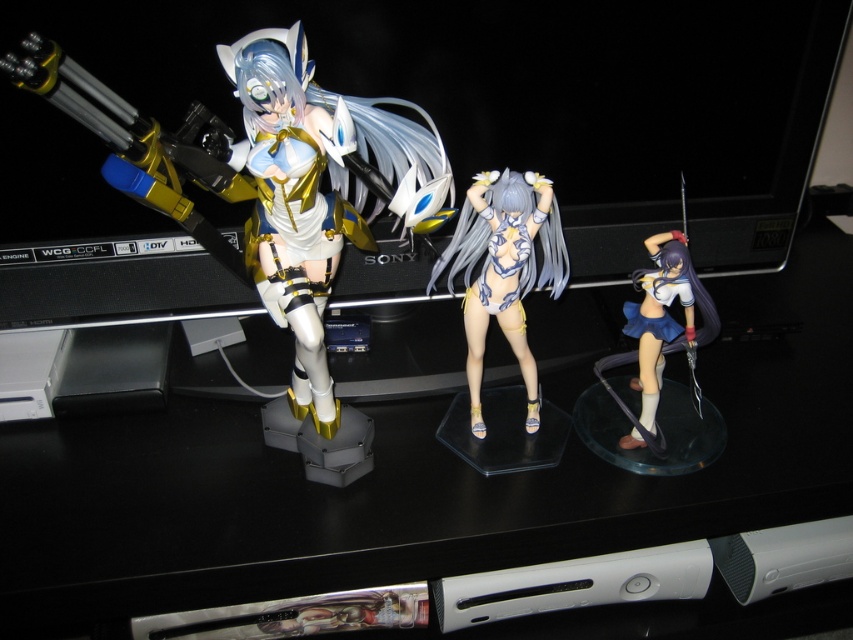
You are a delivery person standing at a distance of 30 inches from the black plastic computer desk at center. Can you reach the desk without moving closer?

The black plastic computer desk at center is 28.89 inches away from the camera, which is slightly closer than your current position of 30 inches. Therefore, you can reach the desk without moving closer.

You are setting up a display for an anime convention and need to arrange two items from left to right. The items are the matte white plastic figure at left and the satin blue skirt at right. Which item should be placed first on the left side of the display?

The matte white plastic figure at left should be placed first on the left side of the display since it is taller than the satin blue skirt at right, ensuring a visually balanced arrangement.